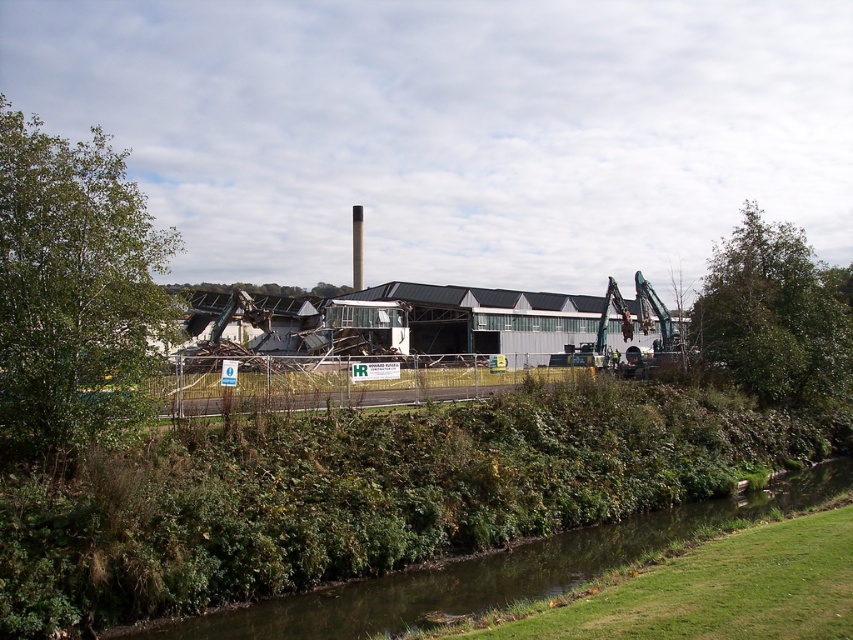
Question: Can you confirm if green leafy tree at left is thinner than green leafy tree at upper right?

Choices:
 (A) yes
 (B) no

Answer: (B)

Question: Which point is farther to the camera?

Choices:
 (A) green grassy river at lower center
 (B) green leafy tree at upper right
 (C) green leafy tree at left

Answer: (B)

Question: Is green leafy tree at left bigger than green leafy tree at upper right?

Choices:
 (A) no
 (B) yes

Answer: (B)

Question: Which of the following is the farthest from the observer?

Choices:
 (A) (68, 161)
 (B) (276, 628)
 (C) (782, 298)

Answer: (C)

Question: Based on their relative distances, which object is farther from the green leafy tree at left?

Choices:
 (A) green leafy tree at upper right
 (B) green grassy river at lower center

Answer: (A)

Question: In this image, where is green leafy tree at left located relative to green grassy river at lower center?

Choices:
 (A) left
 (B) right

Answer: (A)